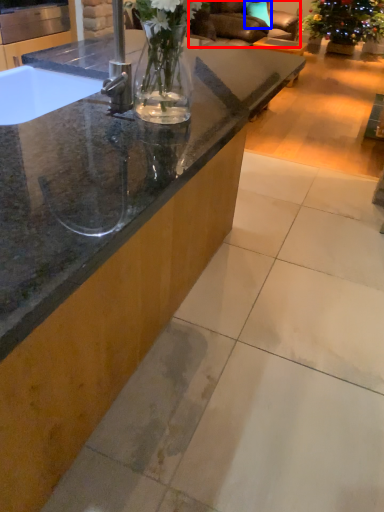
Question: Which object is further to the camera taking this photo, armchair (highlighted by a red box) or pillow (highlighted by a blue box)?

Choices:
 (A) armchair
 (B) pillow

Answer: (B)